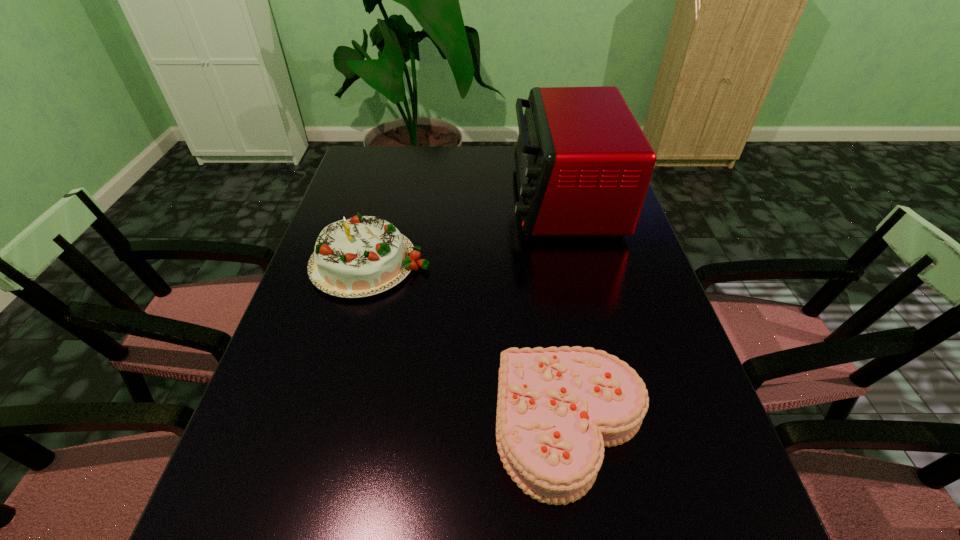
Identify the location of free spot between the farther cake and the right cake. Image resolution: width=960 pixels, height=540 pixels. (471, 344).

Identify the location of vacant area between the shorter cake and the toaster oven. (567, 313).

I want to click on vacant area that lies between the tallest object and the taller cake, so click(468, 230).

This screenshot has width=960, height=540. Find the location of `vacant space that is in between the nearer cake and the leftmost object`. vacant space that is in between the nearer cake and the leftmost object is located at coordinates (471, 344).

Identify the location of free space between the left cake and the shortest object. The height and width of the screenshot is (540, 960). (471, 344).

Find the location of `vacant space that's between the toaster oven and the taller cake`. vacant space that's between the toaster oven and the taller cake is located at coordinates (468, 230).

The height and width of the screenshot is (540, 960). I want to click on vacant space that's between the left cake and the nearer cake, so click(471, 344).

At what (x,y) coordinates should I click in order to perform the action: click on free space between the nearest object and the toaster oven. Please return your answer as a coordinate pair (x, y). The width and height of the screenshot is (960, 540). Looking at the image, I should click on (567, 313).

Find the location of a particular element. The height and width of the screenshot is (540, 960). free space between the second shortest object and the nearer cake is located at coordinates (471, 344).

The height and width of the screenshot is (540, 960). Find the location of `vacant area that lies between the left cake and the toaster oven`. vacant area that lies between the left cake and the toaster oven is located at coordinates (468, 230).